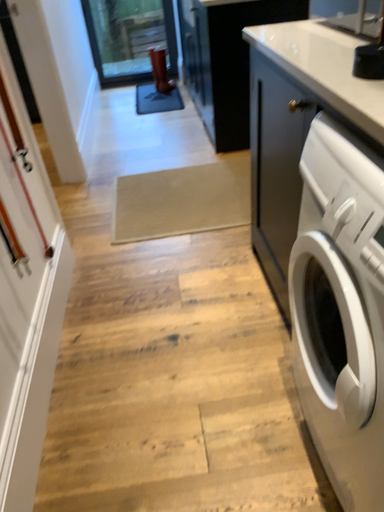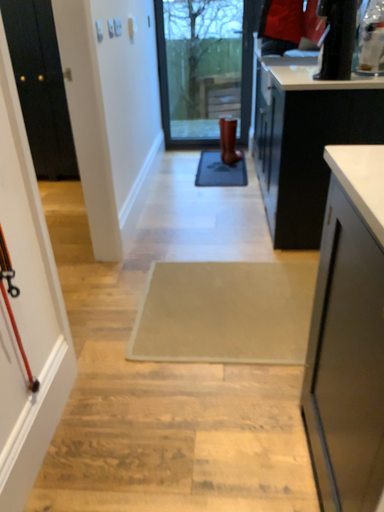
Question: How did the camera likely rotate when shooting the video?

Choices:
 (A) rotated left
 (B) rotated right

Answer: (A)